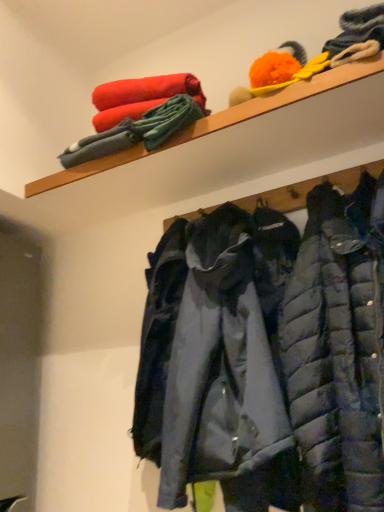
Describe the element at coordinates (280, 99) in the screenshot. This screenshot has width=384, height=512. I see `wooden shelf at upper center` at that location.

Locate an element on the screen. The width and height of the screenshot is (384, 512). wooden shelf at upper center is located at coordinates (280, 99).

The image size is (384, 512). What do you see at coordinates (268, 356) in the screenshot?
I see `dark blue quilted jacket at center` at bounding box center [268, 356].

Identify the location of dark blue quilted jacket at center. This screenshot has height=512, width=384. (268, 356).

Where is `wooden shelf at upper center`? This screenshot has height=512, width=384. wooden shelf at upper center is located at coordinates (280, 99).

Which object is positioned more to the left, wooden shelf at upper center or dark blue quilted jacket at center?

From the viewer's perspective, wooden shelf at upper center appears more on the left side.

Which is behind, wooden shelf at upper center or dark blue quilted jacket at center?

Positioned behind is wooden shelf at upper center.

Considering the positions of points (199, 122) and (312, 423), is point (199, 122) closer to camera compared to point (312, 423)?

That is False.

From the image's perspective, which is below, wooden shelf at upper center or dark blue quilted jacket at center?

dark blue quilted jacket at center is shown below in the image.

Looking at this image, from a real-world perspective, is wooden shelf at upper center located beneath dark blue quilted jacket at center?

No.

Is wooden shelf at upper center wider than dark blue quilted jacket at center?

No, wooden shelf at upper center is not wider than dark blue quilted jacket at center.

From the picture: Considering the sizes of objects wooden shelf at upper center and dark blue quilted jacket at center in the image provided, who is taller, wooden shelf at upper center or dark blue quilted jacket at center?

dark blue quilted jacket at center.

Can you confirm if wooden shelf at upper center is smaller than dark blue quilted jacket at center?

Indeed, wooden shelf at upper center has a smaller size compared to dark blue quilted jacket at center.

Is wooden shelf at upper center inside or outside of dark blue quilted jacket at center?

wooden shelf at upper center cannot be found inside dark blue quilted jacket at center.

Is wooden shelf at upper center with dark blue quilted jacket at center?

No, wooden shelf at upper center is not making contact with dark blue quilted jacket at center.

Is wooden shelf at upper center facing towards dark blue quilted jacket at center?

No, wooden shelf at upper center does not turn towards dark blue quilted jacket at center.

Can you tell me how much wooden shelf at upper center and dark blue quilted jacket at center differ in facing direction?

The angle between the facing direction of wooden shelf at upper center and the facing direction of dark blue quilted jacket at center is 2.21 degrees.

At what (x,y) coordinates should I click in order to perform the action: click on jacket located underneath the wooden shelf at upper center (from a real-world perspective). Please return your answer as a coordinate pair (x, y). The width and height of the screenshot is (384, 512). Looking at the image, I should click on (268, 356).

Considering the positions of objects dark blue quilted jacket at center and wooden shelf at upper center in the image provided, who is more to the right, dark blue quilted jacket at center or wooden shelf at upper center?

dark blue quilted jacket at center is more to the right.

Relative to wooden shelf at upper center, is dark blue quilted jacket at center in front or behind?

Clearly, dark blue quilted jacket at center is in front of wooden shelf at upper center.

Is point (326, 323) farther from camera compared to point (229, 119)?

No.

From the image's perspective, which object appears higher, dark blue quilted jacket at center or wooden shelf at upper center?

From the image's view, wooden shelf at upper center is above.

From a real-world perspective, is dark blue quilted jacket at center physically above wooden shelf at upper center?

No, from a real-world perspective, dark blue quilted jacket at center is not over wooden shelf at upper center

Looking at this image, can you confirm if dark blue quilted jacket at center is wider than wooden shelf at upper center?

Yes, dark blue quilted jacket at center is wider than wooden shelf at upper center.

Who is shorter, dark blue quilted jacket at center or wooden shelf at upper center?

Standing shorter between the two is wooden shelf at upper center.

Who is bigger, dark blue quilted jacket at center or wooden shelf at upper center?

dark blue quilted jacket at center.

Is dark blue quilted jacket at center outside of wooden shelf at upper center?

Yes, dark blue quilted jacket at center is not within wooden shelf at upper center.

Is dark blue quilted jacket at center touching wooden shelf at upper center?

No, dark blue quilted jacket at center is not in contact with wooden shelf at upper center.

Does dark blue quilted jacket at center turn towards wooden shelf at upper center?

No, dark blue quilted jacket at center is not turned towards wooden shelf at upper center.

What's the angular difference between dark blue quilted jacket at center and wooden shelf at upper center's facing directions?

dark blue quilted jacket at center and wooden shelf at upper center are facing 2.21 degrees away from each other.

How much distance is there between dark blue quilted jacket at center and wooden shelf at upper center?

23.10 inches.

The height and width of the screenshot is (512, 384). In order to click on jacket below the wooden shelf at upper center (from a real-world perspective) in this screenshot , I will do `click(268, 356)`.

You are a GUI agent. You are given a task and a screenshot of the screen. Output one action in this format:
    pyautogui.click(x=<x>, y=<y>)
    Task: Click on the jacket below the wooden shelf at upper center (from the image's perspective)
    The image size is (384, 512).
    Given the screenshot: What is the action you would take?
    pyautogui.click(x=268, y=356)

Locate an element on the screen. Image resolution: width=384 pixels, height=512 pixels. jacket lying on the right of wooden shelf at upper center is located at coordinates click(x=268, y=356).